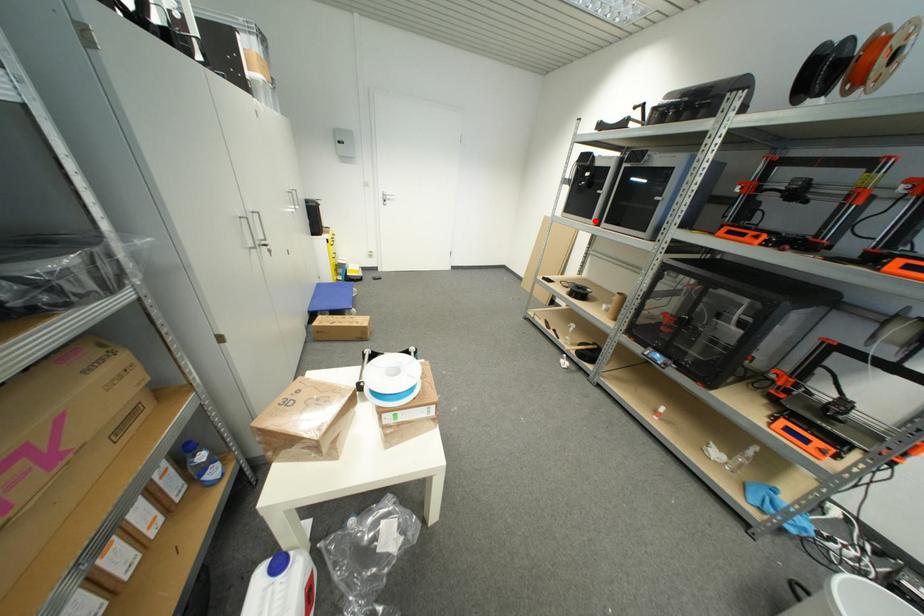
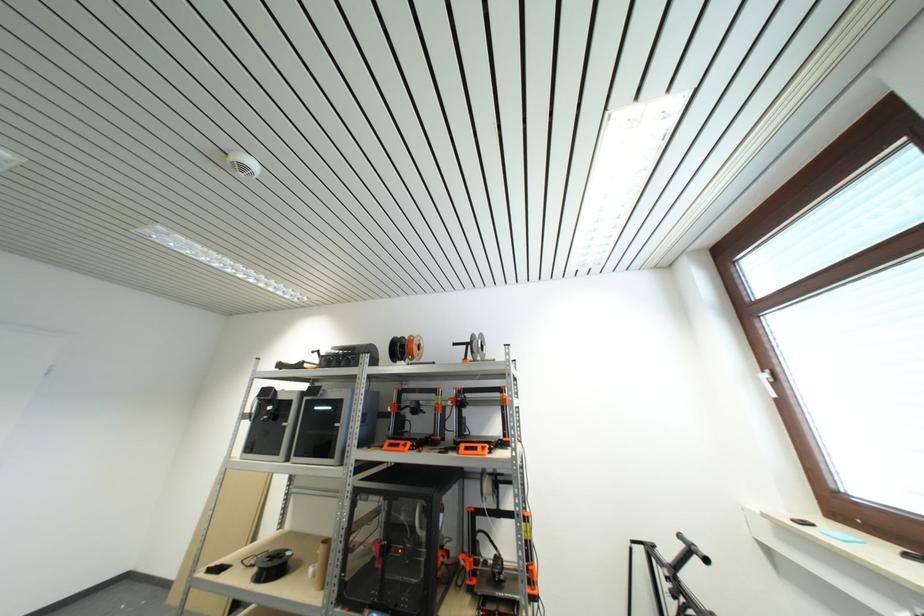
Question: I am providing you with two images of the same scene from different viewpoints. Given a red point in image1, look at the same physical point in image2. Is it:

Choices:
 (A) Closer to the viewpoint
 (B) Farther from the viewpoint

Answer: (B)